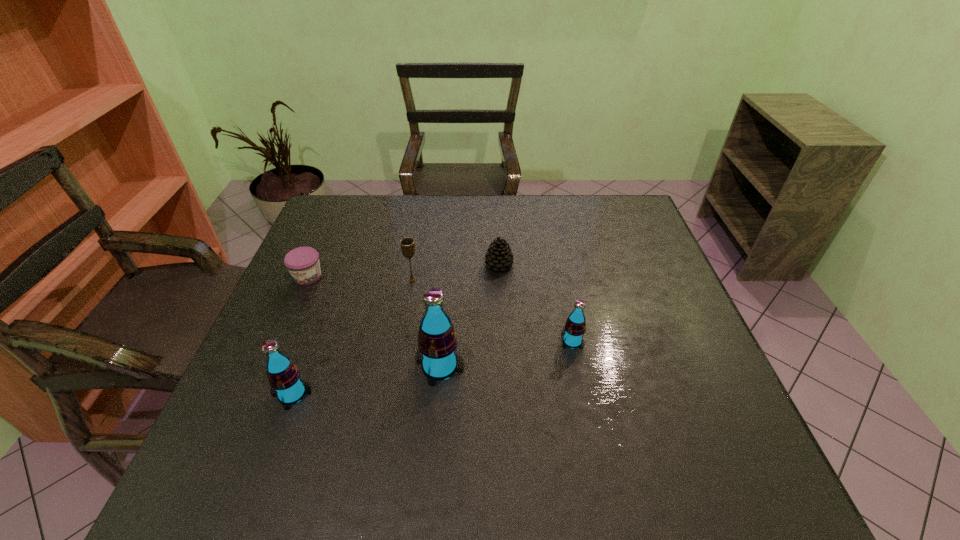
Identify the location of blank area located on the right of the second tallest soda. This screenshot has width=960, height=540. (344, 394).

This screenshot has width=960, height=540. Find the location of `vacant point located 0.300m on the back of the tallest soda`. vacant point located 0.300m on the back of the tallest soda is located at coordinates (448, 265).

This screenshot has height=540, width=960. I want to click on free space located 0.240m on the left of the rightmost object, so tap(461, 341).

In order to click on vacant space situated 0.180m on the front of the fourth object from right to left in this screenshot , I will do `click(403, 335)`.

Find the location of a particular element. The image size is (960, 540). blank space located on the front label of the shortest object is located at coordinates (264, 377).

Where is `free space located at the narrow end of the pinecone`? free space located at the narrow end of the pinecone is located at coordinates (408, 265).

The image size is (960, 540). Find the location of `blank space located 0.270m at the narrow end of the pinecone`. blank space located 0.270m at the narrow end of the pinecone is located at coordinates (391, 265).

This screenshot has height=540, width=960. In order to click on free spot located 0.210m at the narrow end of the pinecone in this screenshot , I will do `click(412, 265)`.

Find the location of a particular element. The width and height of the screenshot is (960, 540). object positioned at the near edge is located at coordinates (284, 377).

Where is `soda positioned at the left edge`? The height and width of the screenshot is (540, 960). soda positioned at the left edge is located at coordinates (284, 377).